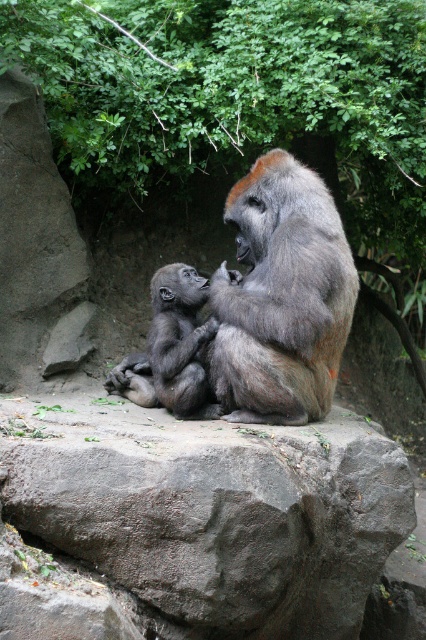
You are a hiker who has just spotted a gray rough boulder at center in the middle of a forest trail. You need to place a GPS marker exactly at its location. According to the coordinates provided, what are the exact coordinates where you should place the marker?

The exact coordinates for the gray rough boulder at center are 0.797 on the x axis and 0.498 on the y axis.

You are a photographer aiming to capture a closeup of the gray furry gorilla at center without including the green leafy tree at upper center in the frame. Based on their positions, can you determine if this is possible?

The green leafy tree at upper center is to the right of the gray furry gorilla at center, so if you position the camera to the left side of the gray furry gorilla at center and frame the shot carefully, you can exclude the tree from the image.